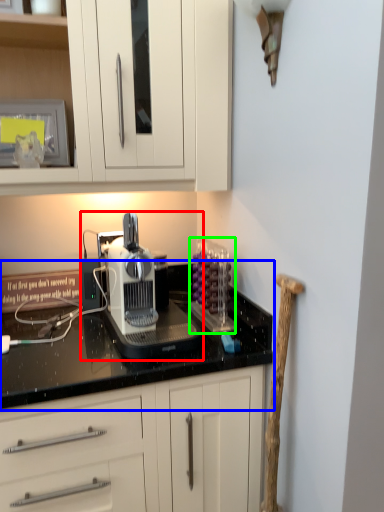
Question: Which is nearer to the home appliance (highlighted by a red box)? countertop (highlighted by a blue box) or kitchen appliance (highlighted by a green box).

Choices:
 (A) countertop
 (B) kitchen appliance

Answer: (A)